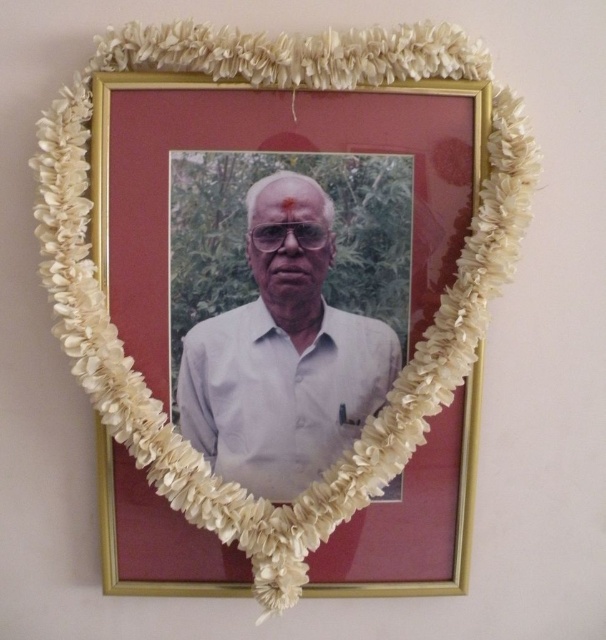
Which is above, gold metallic picture frame at center or white matte shirt at center?

white matte shirt at center

Between gold metallic picture frame at center and white matte shirt at center, which one is positioned lower?

gold metallic picture frame at center

The width and height of the screenshot is (606, 640). I want to click on gold metallic picture frame at center, so click(x=278, y=252).

Identify the location of gold metallic picture frame at center. (278, 252).